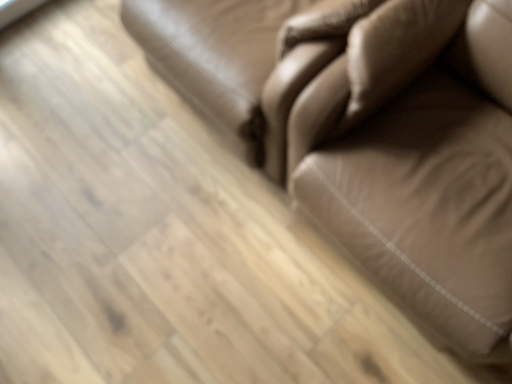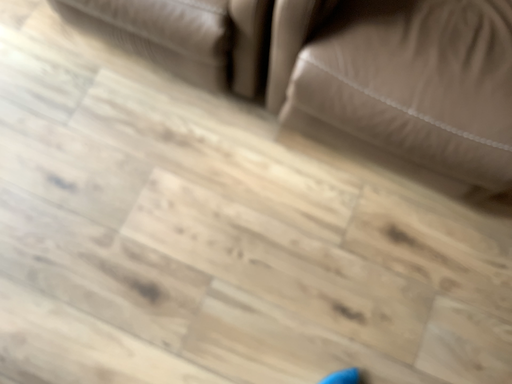
Question: How did the camera likely rotate when shooting the video?

Choices:
 (A) rotated right
 (B) rotated left

Answer: (A)